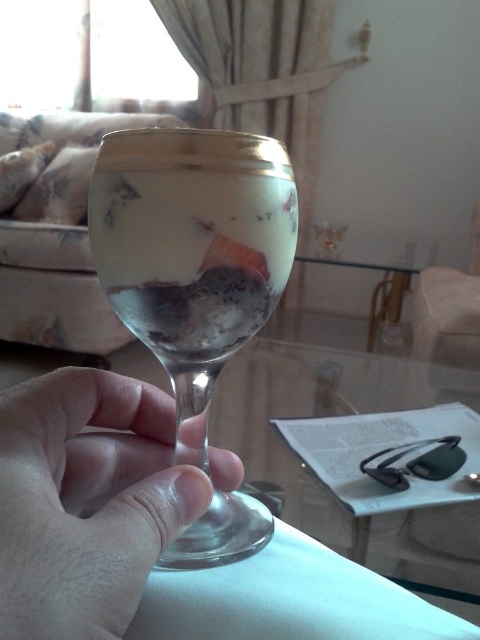
You are arranging drinks on a tray. You have a clear glass martini glass at center and a transparent glass at lower center. Which one should you place on the left side of the tray to match the arrangement in the image?

You should place the transparent glass at lower center on the left side of the tray because in the image, the clear glass martini glass at center is to the right of the transparent glass at lower center.

You are trying to place a small decoration on the clear glass martini glass at center. The decoration has coordinates point [192,250]. Is this point on the clear glass martini glass at center?

Yes, the point [192,250] is on the clear glass martini glass at center, so the decoration can be placed there.

You are a guest at a party and see the transparent glass at lower center on a table. If you want to place a napkin under it, where should you put the napkin relative to the glass?

The transparent glass at lower center is located at point (85,500), so you should place the napkin directly below the glass at that coordinate to ensure it is centered underneath.